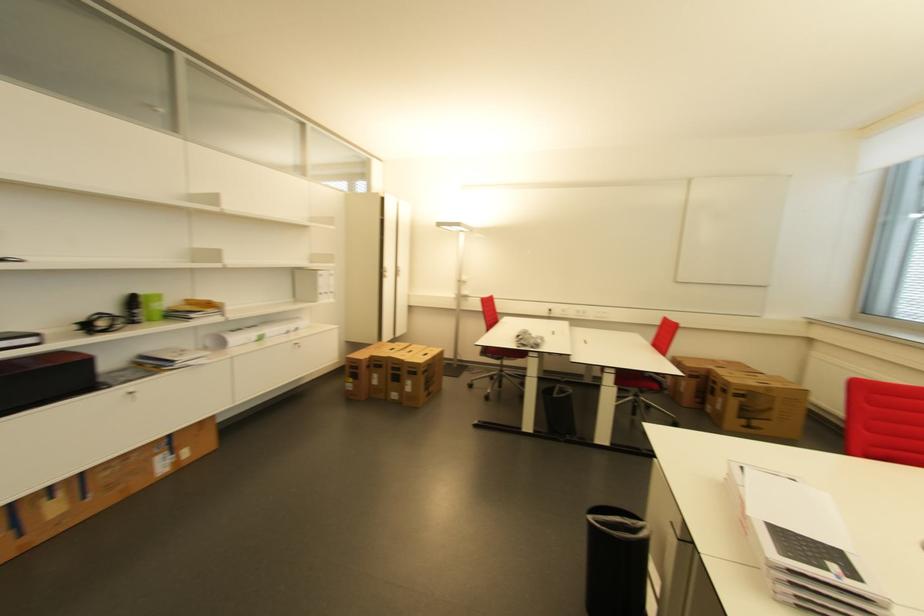
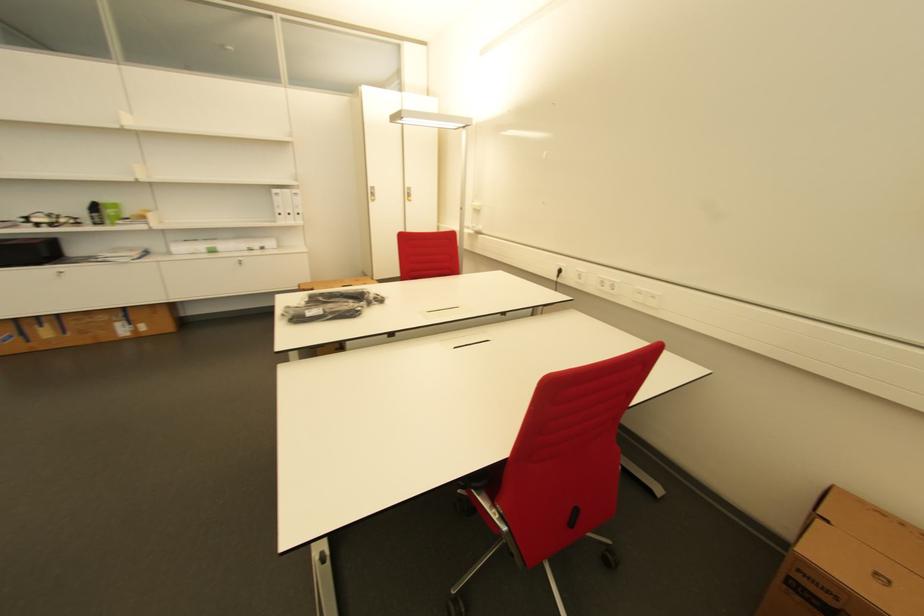
In the second image, find the point that corresponds to the point at 698,379 in the first image.

(805, 600)